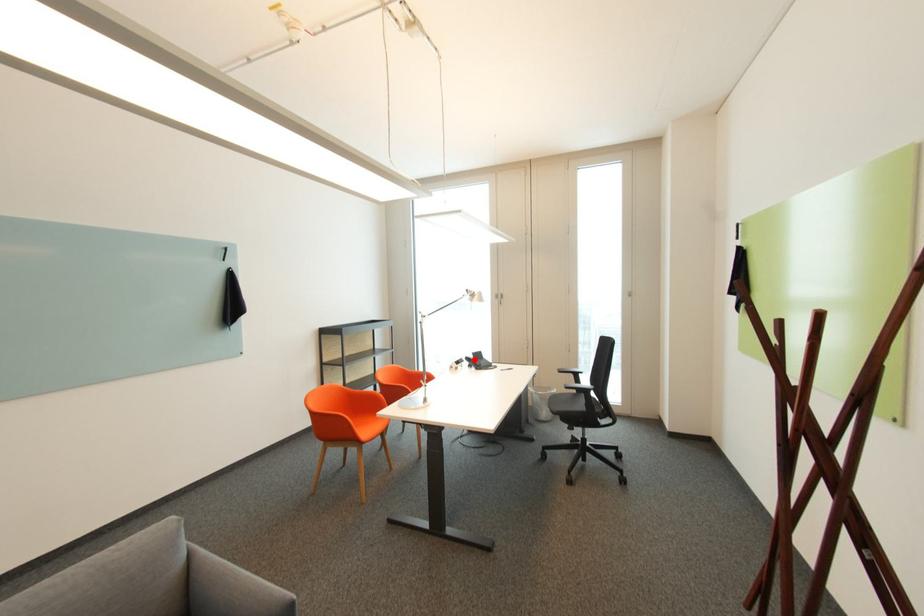
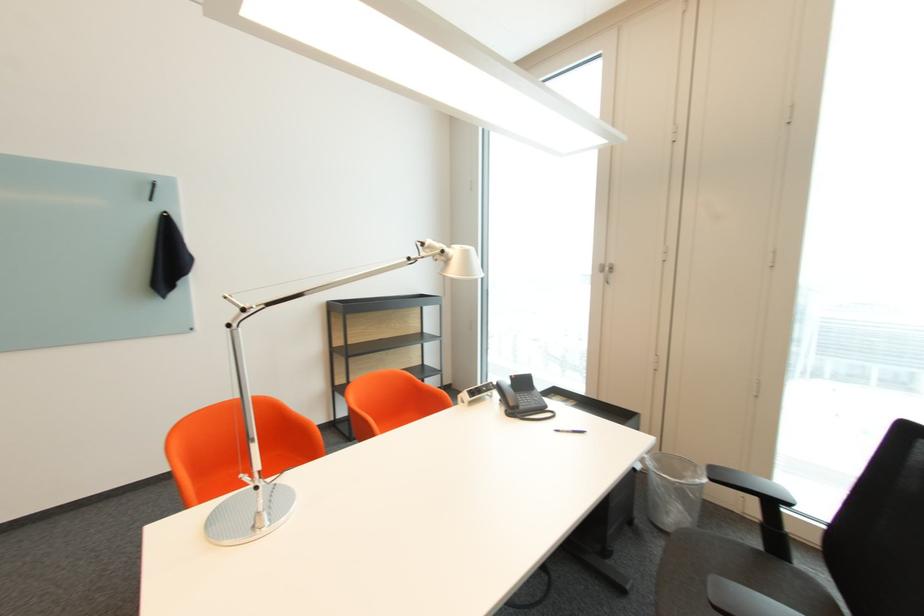
Question: A red point is marked in image1. In image2, is the corresponding 3D point closer to the camera or farther? Reply with the corresponding letter.

Choices:
 (A) The corresponding 3D point is closer.
 (B) The corresponding 3D point is farther.

Answer: (A)